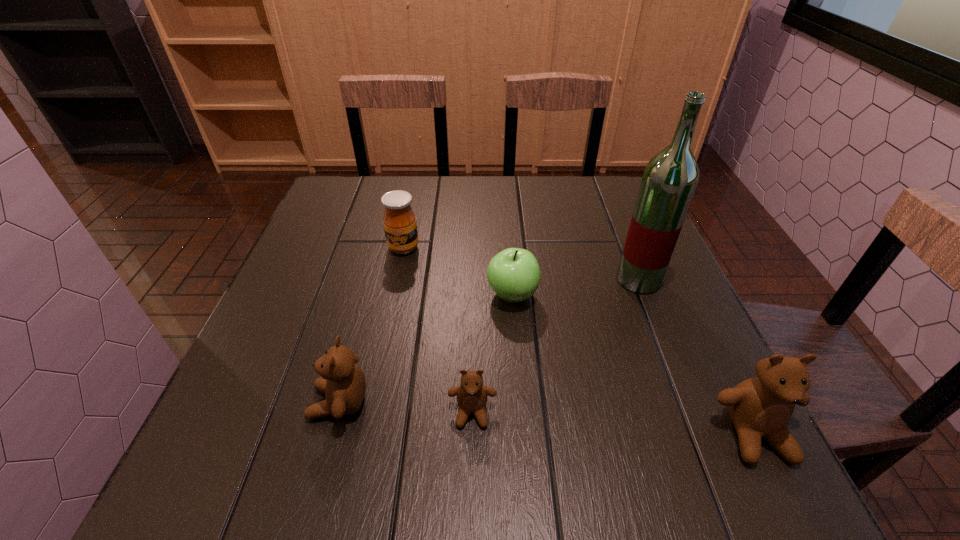
Find the location of a particular element. vacant area at the far right corner is located at coordinates (619, 182).

Find the location of a particular element. The width and height of the screenshot is (960, 540). vacant area that lies between the rightmost teddy bear and the second tallest teddy bear is located at coordinates (547, 418).

Find the location of `empty location between the second teddy bear from right to left and the tallest object`. empty location between the second teddy bear from right to left and the tallest object is located at coordinates (556, 346).

I want to click on empty space that is in between the apple and the leftmost teddy bear, so click(425, 349).

Find the location of `vacant point located between the apple and the rightmost teddy bear`. vacant point located between the apple and the rightmost teddy bear is located at coordinates (634, 364).

The height and width of the screenshot is (540, 960). Find the location of `free spot between the farthest object and the shortest teddy bear`. free spot between the farthest object and the shortest teddy bear is located at coordinates (438, 330).

You are a GUI agent. You are given a task and a screenshot of the screen. Output one action in this format:
    pyautogui.click(x=<x>, y=<y>)
    Task: Click on the unoccupied area between the second shortest teddy bear and the fifth tallest object
    The image size is (960, 540).
    Given the screenshot: What is the action you would take?
    pyautogui.click(x=425, y=349)

What are the coordinates of `free space that is in between the apple and the liquor` in the screenshot? It's located at (575, 287).

What are the coordinates of `free space between the liquor and the apple` in the screenshot? It's located at (575, 287).

You are a GUI agent. You are given a task and a screenshot of the screen. Output one action in this format:
    pyautogui.click(x=<x>, y=<y>)
    Task: Click on the vacant space in between the leftmost teddy bear and the liquor
    The width and height of the screenshot is (960, 540).
    Given the screenshot: What is the action you would take?
    pyautogui.click(x=489, y=341)